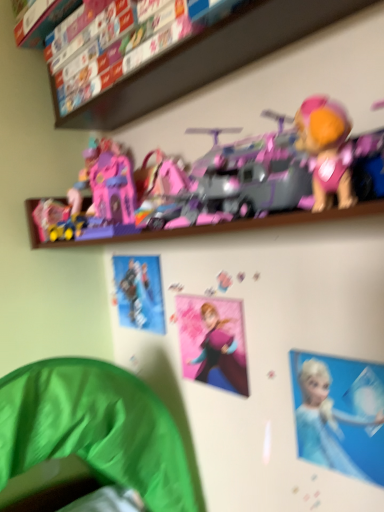
What are the coordinates of `pink plastic castle at upper center, placed as the 1th toy when sorted from top to bottom` in the screenshot? It's located at (233, 182).

This screenshot has height=512, width=384. I want to click on pink plastic toys at upper center, so click(x=205, y=58).

This screenshot has height=512, width=384. Describe the element at coordinates (220, 355) in the screenshot. I see `pink matte anna poster at center, the first toy in the bottom-to-top sequence` at that location.

Locate an element on the screen. The image size is (384, 512). blue glossy poster at upper center, arranged as the first person when viewed from the front is located at coordinates (340, 414).

Is metallic silver figure at upper center, which is the second person in right-to-left order, shorter than pink plastic castle at upper center, placed as the 1th toy when sorted from top to bottom?

Incorrect, the height of metallic silver figure at upper center, which is the second person in right-to-left order, does not fall short of that of pink plastic castle at upper center, placed as the 1th toy when sorted from top to bottom.

Is pink plastic castle at upper center, acting as the second toy starting from the bottom, at the back of metallic silver figure at upper center, the first person from the back?

No.

Considering the relative positions of metallic silver figure at upper center, the first person from the back, and pink plastic castle at upper center, acting as the second toy starting from the bottom, in the image provided, is metallic silver figure at upper center, the first person from the back, to the left or to the right of pink plastic castle at upper center, acting as the second toy starting from the bottom,?

Clearly, metallic silver figure at upper center, the first person from the back, is on the left of pink plastic castle at upper center, acting as the second toy starting from the bottom, in the image.

Does metallic silver figure at upper center, which ranks as the 1th person in top-to-bottom order, lie in front of pink plastic castle at upper center, acting as the second toy starting from the bottom?

No, the depth of metallic silver figure at upper center, which ranks as the 1th person in top-to-bottom order, is greater than that of pink plastic castle at upper center, acting as the second toy starting from the bottom.

Which object is more forward, pink plastic castle at upper center, placed as the 1th toy when sorted from top to bottom, or pink matte anna poster at center, which is counted as the second toy, starting from the top?

Positioned in front is pink plastic castle at upper center, placed as the 1th toy when sorted from top to bottom.

Looking at this image, from a real-world perspective, relative to pink matte anna poster at center, the first toy in the bottom-to-top sequence, is pink plastic castle at upper center, placed as the 1th toy when sorted from top to bottom, vertically above or below?

pink plastic castle at upper center, placed as the 1th toy when sorted from top to bottom, is above pink matte anna poster at center, the first toy in the bottom-to-top sequence.

Is point (201, 189) in front of point (206, 315)?

Yes, it is.

Locate an element on the screen. toy on the left of pink matte anna poster at center, the first toy in the bottom-to-top sequence is located at coordinates (233, 182).

Based on the photo, is pink plastic castle at upper center, acting as the second toy starting from the bottom, oriented towards pink plastic toys at upper center?

No, pink plastic castle at upper center, acting as the second toy starting from the bottom, is not aimed at pink plastic toys at upper center.

Who is bigger, pink plastic castle at upper center, placed as the 1th toy when sorted from top to bottom, or pink plastic toys at upper center?

pink plastic castle at upper center, placed as the 1th toy when sorted from top to bottom.

Which object is wider, pink plastic castle at upper center, acting as the second toy starting from the bottom, or pink plastic toys at upper center?

Wider between the two is pink plastic castle at upper center, acting as the second toy starting from the bottom.

Which is behind, pink plastic castle at upper center, placed as the 1th toy when sorted from top to bottom, or pink plastic toys at upper center?

pink plastic toys at upper center is further away from the camera.

Considering the positions of objects blue glossy poster at upper center, the 2th person positioned from the back, and pink plastic toys at upper center in the image provided, who is behind, blue glossy poster at upper center, the 2th person positioned from the back, or pink plastic toys at upper center?

blue glossy poster at upper center, the 2th person positioned from the back, is further from the camera.

What's the angular difference between blue glossy poster at upper center, the 2th person when ordered from left to right, and pink plastic toys at upper center's facing directions?

0.0732 degrees separate the facing orientations of blue glossy poster at upper center, the 2th person when ordered from left to right, and pink plastic toys at upper center.

Would you say blue glossy poster at upper center, the 2th person when ordered from left to right, is to the left or to the right of pink plastic toys at upper center in the picture?

Based on their positions, blue glossy poster at upper center, the 2th person when ordered from left to right, is located to the right of pink plastic toys at upper center.

Which is further, (x=331, y=433) or (x=294, y=28)?

The point (x=331, y=433) is behind.

Is point (99, 110) farther from viewer compared to point (212, 325)?

Yes.

Considering the sizes of objects pink plastic toys at upper center and pink matte anna poster at center, which is counted as the second toy, starting from the top, in the image provided, who is taller, pink plastic toys at upper center or pink matte anna poster at center, which is counted as the second toy, starting from the top,?

With more height is pink plastic toys at upper center.

From a real-world perspective, is pink plastic toys at upper center positioned above or below pink matte anna poster at center, which is counted as the second toy, starting from the top?

pink plastic toys at upper center is situated higher than pink matte anna poster at center, which is counted as the second toy, starting from the top, in the real world.

Which object is wider, pink plastic toys at upper center or pink matte anna poster at center, which is counted as the second toy, starting from the top?

Wider between the two is pink plastic toys at upper center.

Is pink plastic toys at upper center directly adjacent to metallic silver figure at upper center, the first person positioned from the left?

No, pink plastic toys at upper center is not touching metallic silver figure at upper center, the first person positioned from the left.

Is pink plastic toys at upper center inside the boundaries of metallic silver figure at upper center, marked as the 2th person in a front-to-back arrangement, or outside?

pink plastic toys at upper center is outside metallic silver figure at upper center, marked as the 2th person in a front-to-back arrangement.

Is point (250, 54) more distant than point (134, 268)?

No, it is not.

You are a GUI agent. You are given a task and a screenshot of the screen. Output one action in this format:
    pyautogui.click(x=<x>, y=<y>)
    Task: Click on the person to the left of pink plastic toys at upper center
    This screenshot has width=384, height=512.
    Given the screenshot: What is the action you would take?
    pyautogui.click(x=138, y=294)

From the image's perspective, which is above, pink plastic toys at upper center or pink plastic castle at upper center, placed as the 1th toy when sorted from top to bottom?

pink plastic toys at upper center appears higher in the image.

I want to click on shelf that is on the left side of pink plastic castle at upper center, placed as the 1th toy when sorted from top to bottom, so click(x=205, y=58).

Between pink plastic toys at upper center and pink plastic castle at upper center, acting as the second toy starting from the bottom, which one has larger width?

With larger width is pink plastic castle at upper center, acting as the second toy starting from the bottom.

Looking at this image, can you tell me how much pink plastic toys at upper center and pink plastic castle at upper center, acting as the second toy starting from the bottom, differ in facing direction?

pink plastic toys at upper center and pink plastic castle at upper center, acting as the second toy starting from the bottom, are facing 0.241 degrees away from each other.

Find the location of a particular element. Image resolution: width=384 pixels, height=512 pixels. toy located above the metallic silver figure at upper center, which ranks as the 1th person in top-to-bottom order (from the image's perspective) is located at coordinates (233, 182).

The height and width of the screenshot is (512, 384). In order to click on toy on the right of pink plastic castle at upper center, placed as the 1th toy when sorted from top to bottom in this screenshot , I will do `click(220, 355)`.

From the image, which object appears to be nearer to metallic silver figure at upper center, which is the second person in right-to-left order, pink matte anna poster at center, the first toy in the bottom-to-top sequence, or pink plastic castle at upper center, placed as the 1th toy when sorted from top to bottom?

pink matte anna poster at center, the first toy in the bottom-to-top sequence, is positioned closer to the anchor metallic silver figure at upper center, which is the second person in right-to-left order.

Based on their spatial positions, is pink matte anna poster at center, which is counted as the second toy, starting from the top, or pink plastic toys at upper center closer to metallic silver figure at upper center, the first person from the back?

pink matte anna poster at center, which is counted as the second toy, starting from the top, is closer to metallic silver figure at upper center, the first person from the back.

Looking at the image, which one is located further to blue glossy poster at upper center, arranged as the first person when viewed from the front, metallic silver figure at upper center, the first person positioned from the left, or pink plastic castle at upper center, acting as the second toy starting from the bottom?

Among the two, metallic silver figure at upper center, the first person positioned from the left, is located further to blue glossy poster at upper center, arranged as the first person when viewed from the front.

When comparing their distances from metallic silver figure at upper center, marked as the 2th person in a front-to-back arrangement, does pink plastic toys at upper center or pink matte anna poster at center, which is counted as the second toy, starting from the top, seem further?

Among the two, pink plastic toys at upper center is located further to metallic silver figure at upper center, marked as the 2th person in a front-to-back arrangement.

Estimate the real-world distances between objects in this image. Which object is closer to blue glossy poster at upper center, the 2th person when ordered from left to right, pink plastic toys at upper center or pink matte anna poster at center, the first toy in the bottom-to-top sequence?

Among the two, pink matte anna poster at center, the first toy in the bottom-to-top sequence, is located nearer to blue glossy poster at upper center, the 2th person when ordered from left to right.

Looking at the image, which one is located further to pink matte anna poster at center, the first toy in the bottom-to-top sequence, pink plastic toys at upper center or blue glossy poster at upper center, arranged as the first person when viewed from the front?

The object further to pink matte anna poster at center, the first toy in the bottom-to-top sequence, is pink plastic toys at upper center.

Which object lies nearer to the anchor point blue glossy poster at upper center, the 2th person when ordered from left to right, pink plastic toys at upper center or pink plastic castle at upper center, acting as the second toy starting from the bottom?

pink plastic castle at upper center, acting as the second toy starting from the bottom, lies closer to blue glossy poster at upper center, the 2th person when ordered from left to right, than the other object.

Looking at this image, which object lies further to the anchor point metallic silver figure at upper center, which is the second person in right-to-left order, pink plastic castle at upper center, acting as the second toy starting from the bottom, or blue glossy poster at upper center, positioned as the second person in top-to-bottom order?

Among the two, blue glossy poster at upper center, positioned as the second person in top-to-bottom order, is located further to metallic silver figure at upper center, which is the second person in right-to-left order.

Locate an element on the screen. This screenshot has height=512, width=384. shelf between pink plastic castle at upper center, placed as the 1th toy when sorted from top to bottom, and metallic silver figure at upper center, the first person positioned from the left, along the z-axis is located at coordinates click(205, 58).

Identify the location of person between pink plastic toys at upper center and pink matte anna poster at center, which is counted as the second toy, starting from the top, from top to bottom. This screenshot has width=384, height=512. (138, 294).

Where is `person positioned between pink plastic castle at upper center, placed as the 1th toy when sorted from top to bottom, and metallic silver figure at upper center, which ranks as the 1th person in top-to-bottom order, from near to far`? Image resolution: width=384 pixels, height=512 pixels. person positioned between pink plastic castle at upper center, placed as the 1th toy when sorted from top to bottom, and metallic silver figure at upper center, which ranks as the 1th person in top-to-bottom order, from near to far is located at coordinates (340, 414).

At what (x,y) coordinates should I click in order to perform the action: click on person between pink plastic toys at upper center and blue glossy poster at upper center, arranged as the first person when viewed from the front, vertically. Please return your answer as a coordinate pair (x, y). The width and height of the screenshot is (384, 512). Looking at the image, I should click on (138, 294).